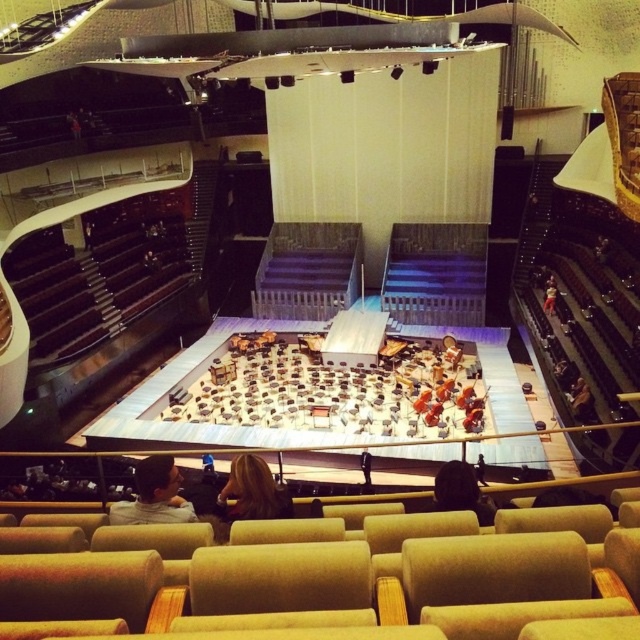
Is light brown leather jacket at lower center shorter than brown hair at center?

Indeed, light brown leather jacket at lower center has a lesser height compared to brown hair at center.

Is point (164, 497) positioned after point (234, 472)?

That is False.

The image size is (640, 640). In order to click on light brown leather jacket at lower center in this screenshot , I will do `click(154, 496)`.

Is light brown leather jacket at lower center behind black leather jacket at center?

No.

Which of these two, light brown leather jacket at lower center or black leather jacket at center, stands taller?

black leather jacket at center

Where is `light brown leather jacket at lower center`? light brown leather jacket at lower center is located at coordinates pos(154,496).

Can you confirm if brown hair at center is positioned to the right of black leather jacket at center?

No, brown hair at center is not to the right of black leather jacket at center.

Can you confirm if brown hair at center is taller than black leather jacket at center?

Indeed, brown hair at center has a greater height compared to black leather jacket at center.

The image size is (640, 640). In order to click on brown hair at center in this screenshot , I will do `click(253, 490)`.